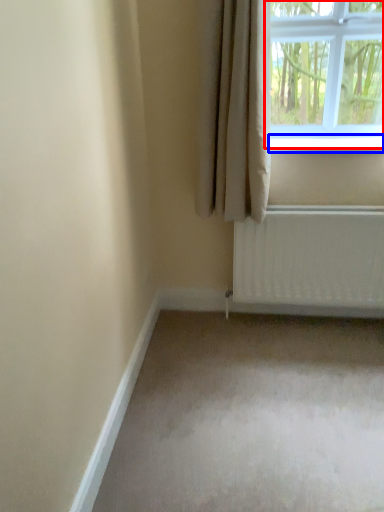
Question: Which object appears farthest to the camera in this image, window (highlighted by a red box) or window sill (highlighted by a blue box)?

Choices:
 (A) window
 (B) window sill

Answer: (B)